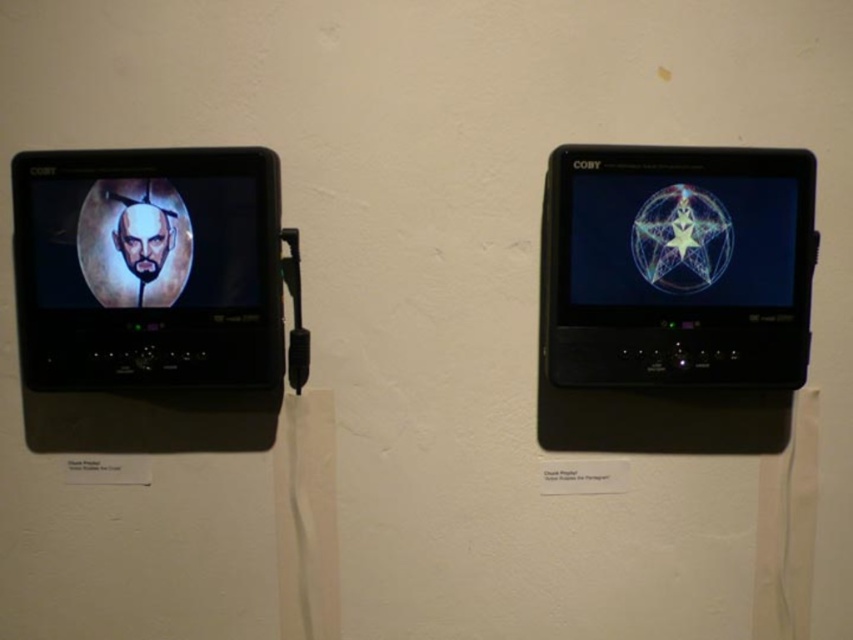
Question: Which object appears closest to the camera in this image?

Choices:
 (A) matte black portrait at left
 (B) matte black monitor at left
 (C) transparent glass sphere at upper right
 (D) matte black smartphone at right

Answer: (B)

Question: Which of these objects is positioned farthest from the matte black portrait at left?

Choices:
 (A) matte black monitor at left
 (B) matte black smartphone at right
 (C) transparent glass sphere at upper right

Answer: (C)

Question: Can you confirm if transparent glass sphere at upper right is thinner than matte black portrait at left?

Choices:
 (A) no
 (B) yes

Answer: (A)

Question: Which point is farther to the camera?

Choices:
 (A) (96, 243)
 (B) (172, 356)

Answer: (B)

Question: Does matte black smartphone at right have a larger size compared to transparent glass sphere at upper right?

Choices:
 (A) yes
 (B) no

Answer: (A)

Question: Is matte black monitor at left below transparent glass sphere at upper right?

Choices:
 (A) yes
 (B) no

Answer: (A)